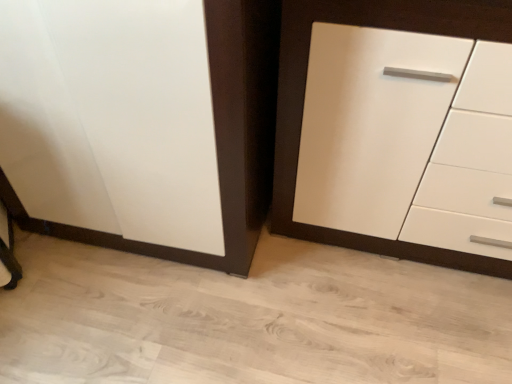
Question: Based on their positions, is white glossy cupboard at left located to the left or right of white glossy cabinet at center right?

Choices:
 (A) right
 (B) left

Answer: (B)

Question: In the image, is white glossy cupboard at left positioned in front of or behind white glossy cabinet at center right?

Choices:
 (A) behind
 (B) front

Answer: (A)

Question: Is white glossy cupboard at left bigger or smaller than white glossy cabinet at center right?

Choices:
 (A) small
 (B) big

Answer: (B)

Question: From the image's perspective, is white glossy cabinet at center right positioned above or below white glossy cupboard at left?

Choices:
 (A) above
 (B) below

Answer: (B)

Question: In terms of size, does white glossy cabinet at center right appear bigger or smaller than white glossy cupboard at left?

Choices:
 (A) small
 (B) big

Answer: (A)

Question: Is white glossy cabinet at center right taller or shorter than white glossy cupboard at left?

Choices:
 (A) short
 (B) tall

Answer: (B)

Question: In the image, is white glossy cabinet at center right on the left side or the right side of white glossy cupboard at left?

Choices:
 (A) right
 (B) left

Answer: (A)